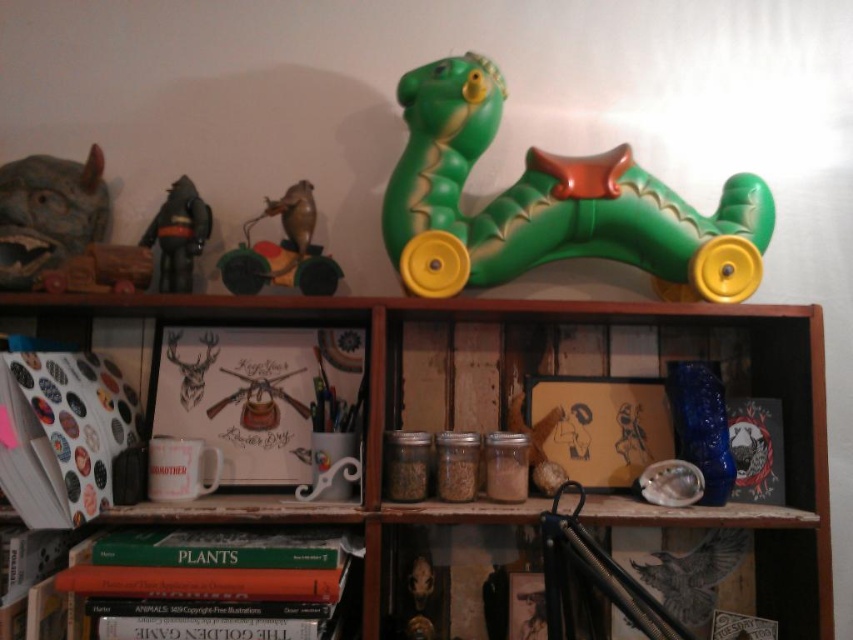
Does green matte book at lower left have a lesser width compared to wooden wagon at left?

In fact, green matte book at lower left might be wider than wooden wagon at left.

Is green matte book at lower left closer to camera compared to wooden wagon at left?

Yes.

Does point (258, 632) come closer to viewer compared to point (45, 291)?

Yes, point (258, 632) is closer to viewer.

Locate an element on the screen. The image size is (853, 640). green matte book at lower left is located at coordinates (206, 586).

Which is more to the right, green matte book at lower left or green rubber toy at upper center?

From the viewer's perspective, green rubber toy at upper center appears more on the right side.

Is point (328, 540) farther from camera compared to point (308, 220)?

That is False.

Does point (277, 605) come behind point (262, 241)?

No, it is in front of (262, 241).

In order to click on green matte book at lower left in this screenshot , I will do `click(206, 586)`.

Can you confirm if white matte book at left is smaller than wooden wagon at left?

Incorrect, white matte book at left is not smaller in size than wooden wagon at left.

Between white matte book at left and wooden wagon at left, which one is positioned lower?

Positioned lower is white matte book at left.

Find the location of `white matte book at left`. white matte book at left is located at coordinates (62, 435).

At what (x,y) coordinates should I click in order to perform the action: click on white matte book at left. Please return your answer as a coordinate pair (x, y). The height and width of the screenshot is (640, 853). Looking at the image, I should click on (62, 435).